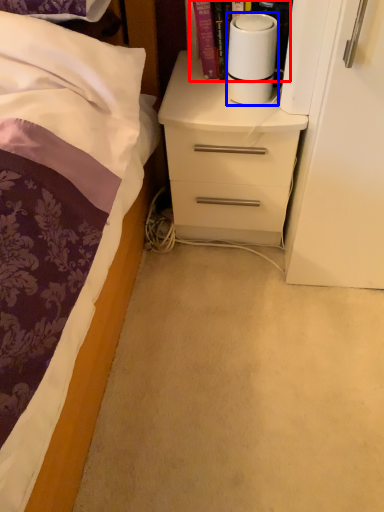
Question: Which of the following is the closest to the observer, book (highlighted by a red box) or paper towel (highlighted by a blue box)?

Choices:
 (A) book
 (B) paper towel

Answer: (B)